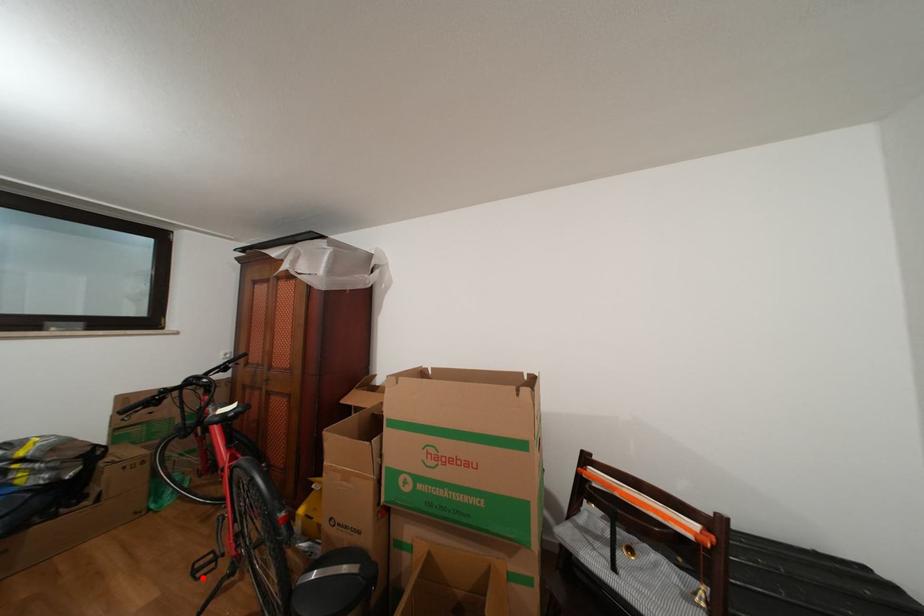
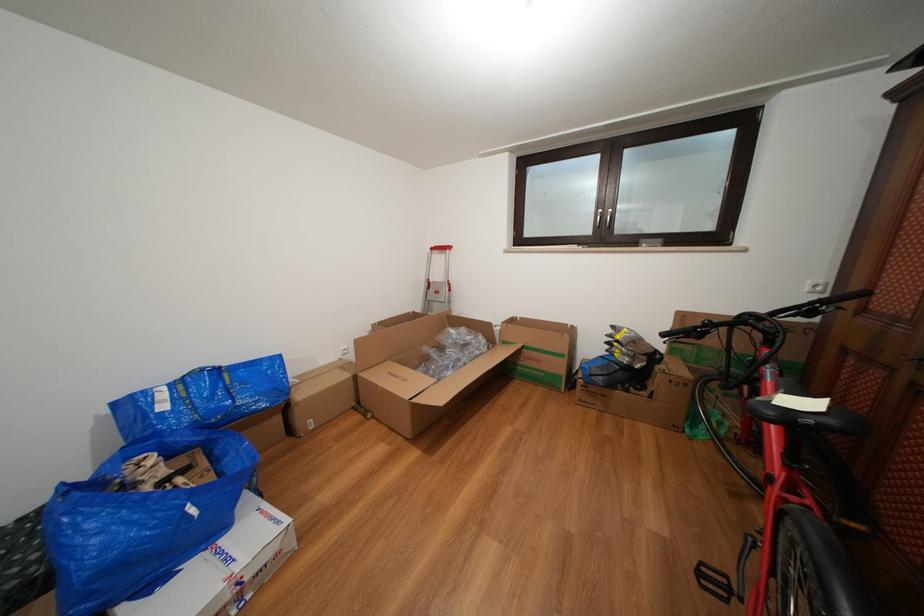
Locate, in the second image, the point that corresponds to the highlighted location in the first image.

(708, 578)